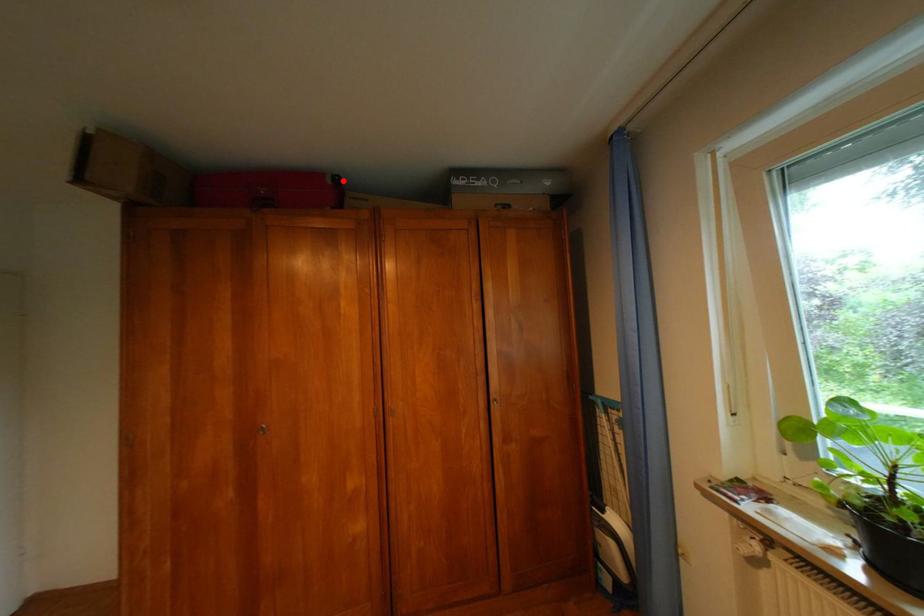
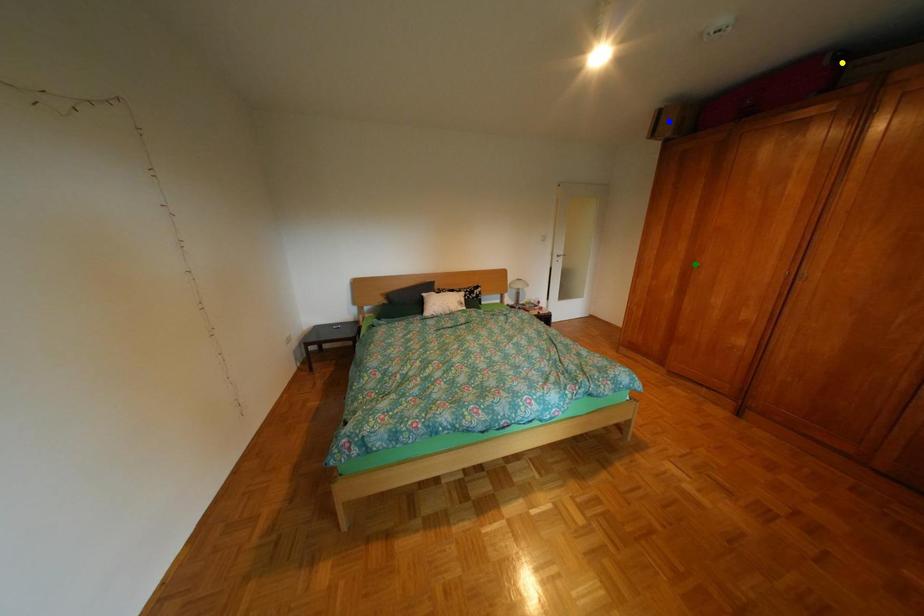
Question: I am providing you with two images of the same scene from different viewpoints. A red point is marked on the first image. You are given multiple points on the second image. Can you choose the point in image 2 that corresponds to the point in image 1?

Choices:
 (A) yellow point
 (B) blue point
 (C) green point

Answer: (A)